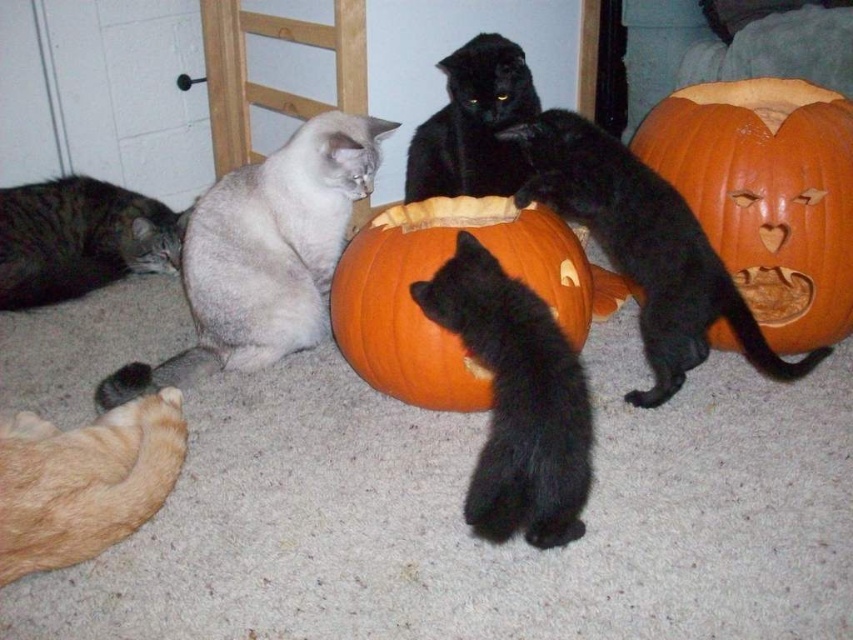
Question: Does orange matte pumpkin at center appear over tabby fur cat at left?

Choices:
 (A) no
 (B) yes

Answer: (A)

Question: Which point is closer to the camera?

Choices:
 (A) black fluffy cat at upper right
 (B) orange carved pumpkin at center

Answer: (A)

Question: Is orange matte pumpkin at center further to the viewer compared to black fluffy cat at upper right?

Choices:
 (A) no
 (B) yes

Answer: (A)

Question: Among these objects, which one is farthest from the camera?

Choices:
 (A) orange matte pumpkin at center
 (B) black matte cat at upper center
 (C) silvery fur cat at center
 (D) tabby fur cat at left

Answer: (D)

Question: Which of the following is the closest to the observer?

Choices:
 (A) black fluffy cat at upper right
 (B) orange matte pumpkin at center
 (C) silvery fur cat at center

Answer: (B)

Question: Is orange matte pumpkin at center positioned at the back of black matte cat at upper center?

Choices:
 (A) yes
 (B) no

Answer: (B)